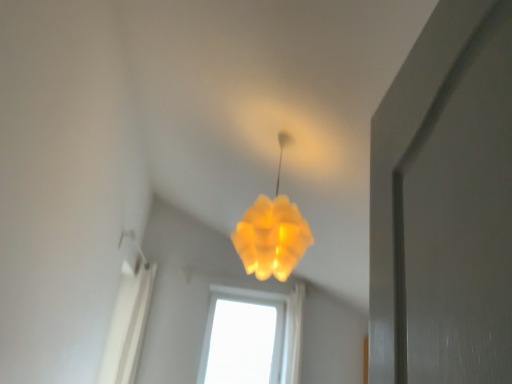
At what (x,y) coordinates should I click in order to perform the action: click on transparent glass window at center. Please return your answer as a coordinate pair (x, y). Image resolution: width=512 pixels, height=384 pixels. Looking at the image, I should click on (252, 337).

What is the approximate width of transparent glass window at center?

4.56 inches.

What do you see at coordinates (252, 337) in the screenshot? The image size is (512, 384). I see `transparent glass window at center` at bounding box center [252, 337].

This screenshot has height=384, width=512. Describe the element at coordinates (272, 232) in the screenshot. I see `translucent yellow lampshade at center` at that location.

Measure the distance between point (306, 246) and camera.

Point (306, 246) and camera are 3.46 meters apart.

Where is `translucent yellow lampshade at center`? The width and height of the screenshot is (512, 384). translucent yellow lampshade at center is located at coordinates (272, 232).

In order to face translucent yellow lampshade at center, should I rotate leftwards or rightwards?

Turn right by 2.351 degrees to look at translucent yellow lampshade at center.

Locate an element on the screen. transparent glass window at center is located at coordinates (252, 337).

Visually, is transparent glass window at center positioned to the left or to the right of translucent yellow lampshade at center?

In the image, transparent glass window at center appears on the left side of translucent yellow lampshade at center.

Is transparent glass window at center further to the viewer compared to translucent yellow lampshade at center?

That is True.

Which is farther from the camera, (214, 362) or (254, 244)?

Point (214, 362)

From the image's perspective, is transparent glass window at center located above or below translucent yellow lampshade at center?

Clearly, from the image's perspective, transparent glass window at center is below translucent yellow lampshade at center.

In the scene shown: From a real-world perspective, is transparent glass window at center below translucent yellow lampshade at center?

Yes, from a real-world perspective, transparent glass window at center is beneath translucent yellow lampshade at center.

Between transparent glass window at center and translucent yellow lampshade at center, which one has smaller width?

With smaller width is transparent glass window at center.

Is transparent glass window at center taller than translucent yellow lampshade at center?

Yes.

Considering the sizes of objects transparent glass window at center and translucent yellow lampshade at center in the image provided, who is smaller, transparent glass window at center or translucent yellow lampshade at center?

With smaller size is transparent glass window at center.

Is transparent glass window at center completely or partially outside of translucent yellow lampshade at center?

That's correct, transparent glass window at center is outside of translucent yellow lampshade at center.

Is transparent glass window at center not near translucent yellow lampshade at center?

transparent glass window at center is positioned a significant distance from translucent yellow lampshade at center.

Is transparent glass window at center turned away from translucent yellow lampshade at center?

No, transparent glass window at center is not facing away from translucent yellow lampshade at center.

How different are the orientations of transparent glass window at center and translucent yellow lampshade at center in degrees?

transparent glass window at center and translucent yellow lampshade at center are facing 81.6 degrees away from each other.

Locate an element on the screen. lamp on the right of transparent glass window at center is located at coordinates point(272,232).

Is translucent yellow lampshade at center to the left or to the right of transparent glass window at center in the image?

translucent yellow lampshade at center is to the right of transparent glass window at center.

Relative to transparent glass window at center, is translucent yellow lampshade at center in front or behind?

In the image, translucent yellow lampshade at center appears in front of transparent glass window at center.

Is point (295, 236) behind point (240, 312)?

No.

From the image's perspective, is translucent yellow lampshade at center over transparent glass window at center?

Yes.

From a real-world perspective, between translucent yellow lampshade at center and transparent glass window at center, who is vertically higher?

translucent yellow lampshade at center.

Is translucent yellow lampshade at center wider than transparent glass window at center?

Correct, the width of translucent yellow lampshade at center exceeds that of transparent glass window at center.

Which of these two, translucent yellow lampshade at center or transparent glass window at center, stands shorter?

With less height is translucent yellow lampshade at center.

Based on their sizes in the image, would you say translucent yellow lampshade at center is bigger or smaller than transparent glass window at center?

In the image, translucent yellow lampshade at center appears to be larger than transparent glass window at center.

Is translucent yellow lampshade at center completely or partially outside of transparent glass window at center?

translucent yellow lampshade at center is positioned outside transparent glass window at center.

Is there a large distance between translucent yellow lampshade at center and transparent glass window at center?

Yes, translucent yellow lampshade at center and transparent glass window at center are quite far apart.

Is transparent glass window at center at the back of translucent yellow lampshade at center?

That's not correct — translucent yellow lampshade at center is not looking away from transparent glass window at center.

How many degrees apart are the facing directions of translucent yellow lampshade at center and transparent glass window at center?

81.6 degrees separate the facing orientations of translucent yellow lampshade at center and transparent glass window at center.

The image size is (512, 384). I want to click on window located below the translucent yellow lampshade at center (from the image's perspective), so 252,337.

The height and width of the screenshot is (384, 512). I want to click on lamp that is above the transparent glass window at center (from a real-world perspective), so click(272, 232).

Where is `lamp that appears above the transparent glass window at center (from the image's perspective)`? The width and height of the screenshot is (512, 384). lamp that appears above the transparent glass window at center (from the image's perspective) is located at coordinates (272, 232).